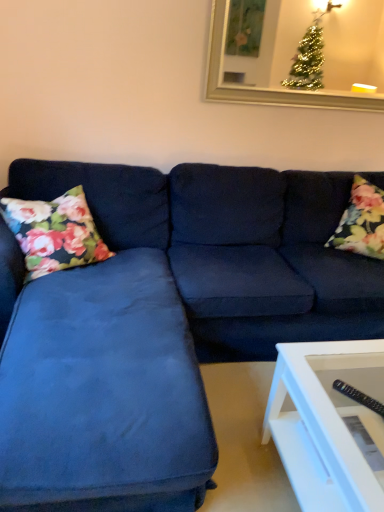
Image resolution: width=384 pixels, height=512 pixels. What do you see at coordinates (54, 233) in the screenshot? I see `floral fabric pillow at left, which ranks as the first pillow in left-to-right order` at bounding box center [54, 233].

You are a GUI agent. You are given a task and a screenshot of the screen. Output one action in this format:
    pyautogui.click(x=<x>, y=<y>)
    Task: Click on the gold-framed mirror at upper center
    
    Given the screenshot: What is the action you would take?
    pyautogui.click(x=298, y=53)

Where is `floral fabric pillow at left, placed as the 2th pillow when sorted from right to left`? Image resolution: width=384 pixels, height=512 pixels. floral fabric pillow at left, placed as the 2th pillow when sorted from right to left is located at coordinates (54, 233).

Does point (178, 468) appear closer or farther from the camera than point (339, 245)?

Point (178, 468).

From their relative heights in the image, would you say suede blue couch at center is taller or shorter than floral fabric pillow at right, the first pillow viewed from the right?

In the image, suede blue couch at center appears to be taller than floral fabric pillow at right, the first pillow viewed from the right.

Is suede blue couch at center positioned before floral fabric pillow at right, the first pillow viewed from the right?

Yes, the depth of suede blue couch at center is less than that of floral fabric pillow at right, the first pillow viewed from the right.

Is suede blue couch at center outside of floral fabric pillow at right, the first pillow viewed from the right?

Indeed, suede blue couch at center is completely outside floral fabric pillow at right, the first pillow viewed from the right.

Would you say suede blue couch at center is part of floral fabric pillow at right, the first pillow viewed from the right,'s contents?

No, suede blue couch at center is not surrounded by floral fabric pillow at right, the first pillow viewed from the right.

How distant is floral fabric pillow at right, which ranks as the second pillow in left-to-right order, from suede blue couch at center?

A distance of 26.68 inches exists between floral fabric pillow at right, which ranks as the second pillow in left-to-right order, and suede blue couch at center.

Image resolution: width=384 pixels, height=512 pixels. Find the location of `studio couch in front of the floral fabric pillow at right, the first pillow viewed from the right`. studio couch in front of the floral fabric pillow at right, the first pillow viewed from the right is located at coordinates (162, 322).

Is floral fabric pillow at right, which ranks as the second pillow in left-to-right order, behind suede blue couch at center?

That is True.

From a real-world perspective, count 1st pillows upward from the suede blue couch at center and point to it. Please provide its 2D coordinates.

[(54, 233)]

Can we say floral fabric pillow at left, placed as the 2th pillow when sorted from right to left, lies outside suede blue couch at center?

Result: No, floral fabric pillow at left, placed as the 2th pillow when sorted from right to left, is inside suede blue couch at center's boundary.

Does point (62, 233) lie in front of point (15, 182)?

Yes.

Is floral fabric pillow at left, placed as the 2th pillow when sorted from right to left, in front of or behind suede blue couch at center in the image?

Clearly, floral fabric pillow at left, placed as the 2th pillow when sorted from right to left, is behind suede blue couch at center.

Is gold-framed mirror at upper center taller than floral fabric pillow at right, the first pillow viewed from the right?

In fact, gold-framed mirror at upper center may be shorter than floral fabric pillow at right, the first pillow viewed from the right.

Between point (356, 81) and point (383, 194), which one is positioned in front?

The point (383, 194) is more forward.

From the image's perspective, which pillow is the 1st one below the gold-framed mirror at upper center? Please provide its 2D coordinates.

[(361, 221)]

Looking at this image, how much distance is there between gold-framed mirror at upper center and floral fabric pillow at right, which ranks as the second pillow in left-to-right order?

The distance of gold-framed mirror at upper center from floral fabric pillow at right, which ranks as the second pillow in left-to-right order, is 4.09 meters.

Based on the photo, is floral fabric pillow at right, the first pillow viewed from the right, smaller than gold-framed mirror at upper center?

No.

Is floral fabric pillow at right, the first pillow viewed from the right, turned away from gold-framed mirror at upper center?

No, floral fabric pillow at right, the first pillow viewed from the right, is not facing away from gold-framed mirror at upper center.

Is floral fabric pillow at right, the first pillow viewed from the right, directly adjacent to gold-framed mirror at upper center?

floral fabric pillow at right, the first pillow viewed from the right, and gold-framed mirror at upper center are not in contact.

Is floral fabric pillow at right, which ranks as the second pillow in left-to-right order, oriented away from floral fabric pillow at left, which ranks as the first pillow in left-to-right order?

No.

From the picture: Measure the distance between floral fabric pillow at right, which ranks as the second pillow in left-to-right order, and floral fabric pillow at left, which ranks as the first pillow in left-to-right order.

floral fabric pillow at right, which ranks as the second pillow in left-to-right order, and floral fabric pillow at left, which ranks as the first pillow in left-to-right order, are 1.49 meters apart.

Would you say floral fabric pillow at right, which ranks as the second pillow in left-to-right order, is inside or outside floral fabric pillow at left, placed as the 2th pillow when sorted from right to left?

floral fabric pillow at right, which ranks as the second pillow in left-to-right order, is not enclosed by floral fabric pillow at left, placed as the 2th pillow when sorted from right to left.

From a real-world perspective, who is located lower, floral fabric pillow at right, the first pillow viewed from the right, or floral fabric pillow at left, placed as the 2th pillow when sorted from right to left?

floral fabric pillow at left, placed as the 2th pillow when sorted from right to left, from a real-world perspective.

In order to click on studio couch located below the floral fabric pillow at left, which ranks as the first pillow in left-to-right order (from the image's perspective) in this screenshot , I will do `click(162, 322)`.

From a real-world perspective, is suede blue couch at center positioned over floral fabric pillow at left, which ranks as the first pillow in left-to-right order, based on gravity?

No, from a real-world perspective, suede blue couch at center is not above floral fabric pillow at left, which ranks as the first pillow in left-to-right order.

You are a GUI agent. You are given a task and a screenshot of the screen. Output one action in this format:
    pyautogui.click(x=<x>, y=<y>)
    Task: Click on the studio couch that is in front of the floral fabric pillow at right, which ranks as the second pillow in left-to-right order
    This screenshot has height=512, width=384.
    Given the screenshot: What is the action you would take?
    pyautogui.click(x=162, y=322)

I want to click on the 2nd pillow behind the suede blue couch at center, so 361,221.

Looking at the image, which one is located closer to floral fabric pillow at left, which ranks as the first pillow in left-to-right order, suede blue couch at center or floral fabric pillow at right, which ranks as the second pillow in left-to-right order?

suede blue couch at center lies closer to floral fabric pillow at left, which ranks as the first pillow in left-to-right order, than the other object.

Which object lies further to the anchor point floral fabric pillow at right, which ranks as the second pillow in left-to-right order, floral fabric pillow at left, which ranks as the first pillow in left-to-right order, or suede blue couch at center?

floral fabric pillow at left, which ranks as the first pillow in left-to-right order, is positioned further to the anchor floral fabric pillow at right, which ranks as the second pillow in left-to-right order.

Estimate the real-world distances between objects in this image. Which object is closer to gold-framed mirror at upper center, suede blue couch at center or floral fabric pillow at right, which ranks as the second pillow in left-to-right order?

floral fabric pillow at right, which ranks as the second pillow in left-to-right order, is closer to gold-framed mirror at upper center.

When comparing their distances from gold-framed mirror at upper center, does suede blue couch at center or floral fabric pillow at left, placed as the 2th pillow when sorted from right to left, seem closer?

Among the two, suede blue couch at center is located nearer to gold-framed mirror at upper center.

Which object lies further to the anchor point suede blue couch at center, floral fabric pillow at left, which ranks as the first pillow in left-to-right order, or floral fabric pillow at right, the first pillow viewed from the right?

floral fabric pillow at right, the first pillow viewed from the right, lies further to suede blue couch at center than the other object.

Based on the photo, which object lies nearer to the anchor point floral fabric pillow at left, which ranks as the first pillow in left-to-right order, gold-framed mirror at upper center or floral fabric pillow at right, which ranks as the second pillow in left-to-right order?

floral fabric pillow at right, which ranks as the second pillow in left-to-right order, is positioned closer to the anchor floral fabric pillow at left, which ranks as the first pillow in left-to-right order.

Based on their spatial positions, is floral fabric pillow at right, the first pillow viewed from the right, or gold-framed mirror at upper center further from floral fabric pillow at left, placed as the 2th pillow when sorted from right to left?

The object further to floral fabric pillow at left, placed as the 2th pillow when sorted from right to left, is gold-framed mirror at upper center.

Based on their spatial positions, is floral fabric pillow at left, placed as the 2th pillow when sorted from right to left, or floral fabric pillow at right, the first pillow viewed from the right, closer to gold-framed mirror at upper center?

floral fabric pillow at right, the first pillow viewed from the right, lies closer to gold-framed mirror at upper center than the other object.

This screenshot has width=384, height=512. Find the location of `picture frame between floral fabric pillow at left, which ranks as the first pillow in left-to-right order, and floral fabric pillow at right, the first pillow viewed from the right`. picture frame between floral fabric pillow at left, which ranks as the first pillow in left-to-right order, and floral fabric pillow at right, the first pillow viewed from the right is located at coordinates (298, 53).

Identify the location of studio couch between floral fabric pillow at left, which ranks as the first pillow in left-to-right order, and floral fabric pillow at right, the first pillow viewed from the right, from left to right. (162, 322).

The height and width of the screenshot is (512, 384). Identify the location of picture frame positioned between suede blue couch at center and floral fabric pillow at right, the first pillow viewed from the right, from near to far. (298, 53).